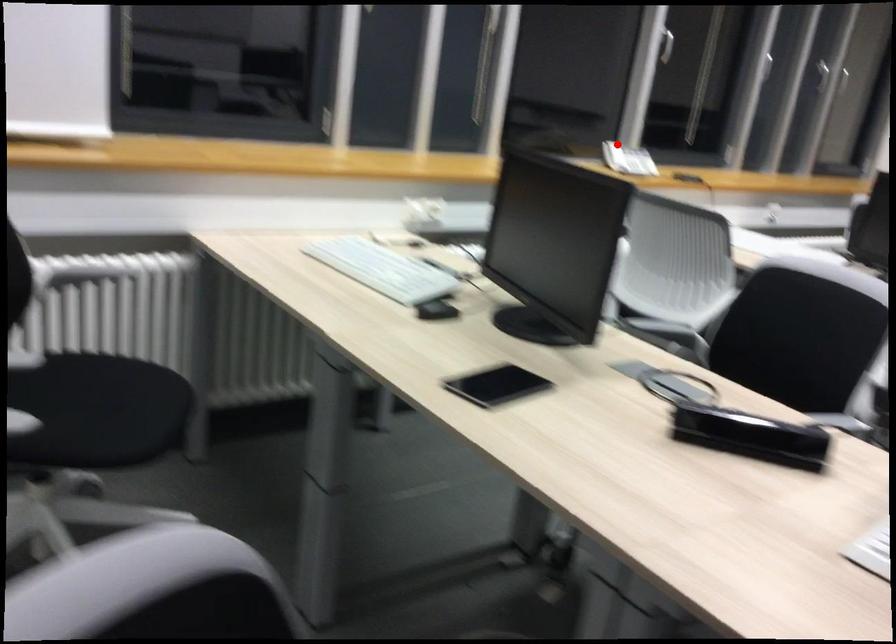
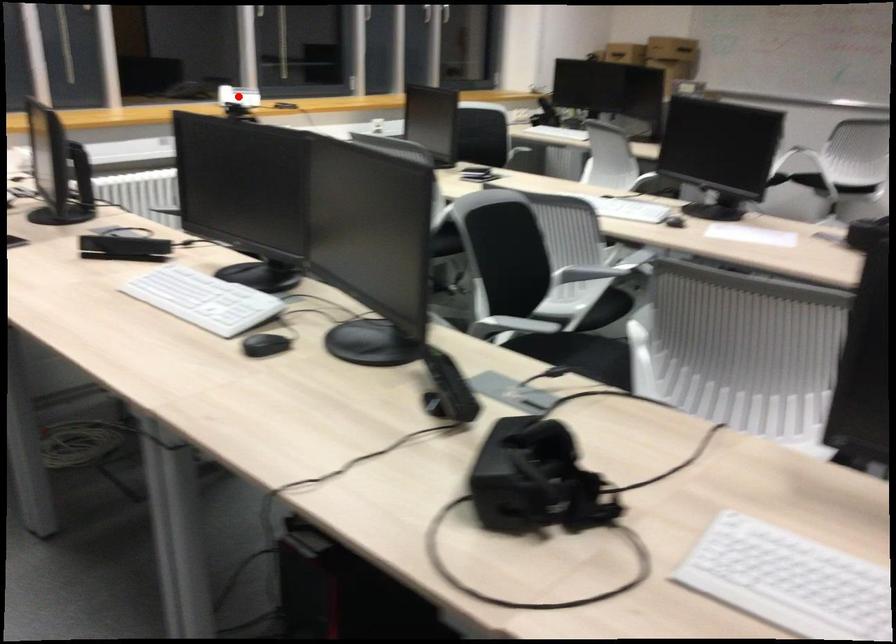
I am providing you with two images of the same scene from different viewpoints. A red point is marked on the first image and another point is marked on the second image. Does the point marked in image1 correspond to the same location as the one in image2?

Yes